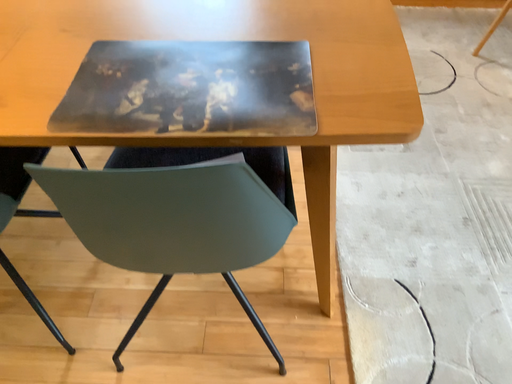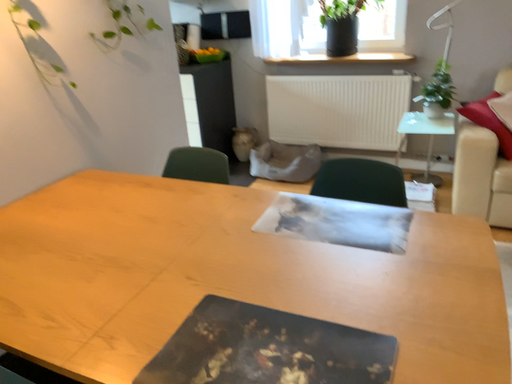
Question: How did the camera likely rotate when shooting the video?

Choices:
 (A) rotated upward
 (B) rotated downward

Answer: (A)